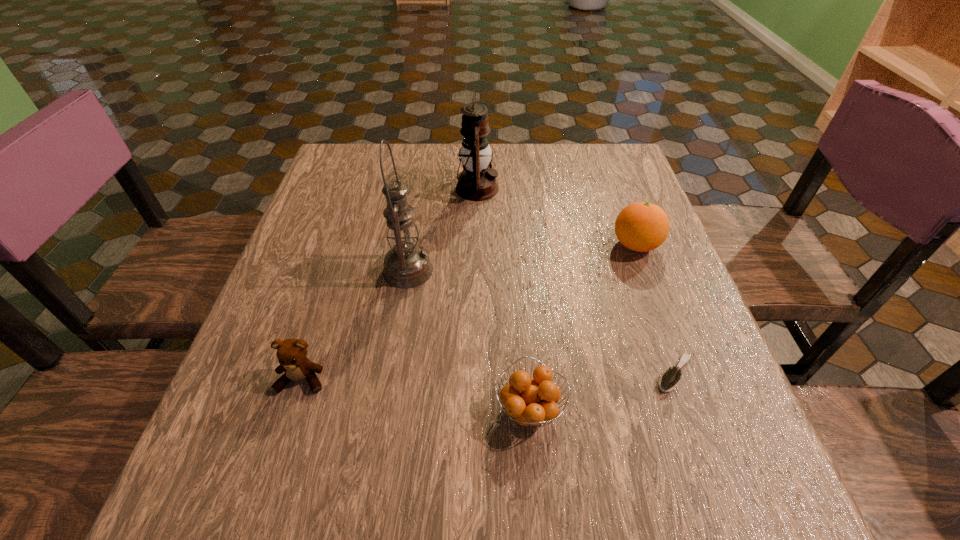
In the image, there is a desktop. At what (x,y) coordinates should I click in order to perform the action: click on vacant space at the left edge. Please return your answer as a coordinate pair (x, y). The width and height of the screenshot is (960, 540). Looking at the image, I should click on (252, 435).

Image resolution: width=960 pixels, height=540 pixels. What are the coordinates of `vacant space at the right edge of the desktop` in the screenshot? It's located at (653, 298).

Where is `free spot at the far left corner of the desktop`? free spot at the far left corner of the desktop is located at coordinates (335, 151).

In the image, there is a desktop. At what (x,y) coordinates should I click in order to perform the action: click on vacant area at the far right corner. Please return your answer as a coordinate pair (x, y). Looking at the image, I should click on (603, 150).

Image resolution: width=960 pixels, height=540 pixels. What are the coordinates of `empty space between the shortest object and the farther orange fruit` in the screenshot? It's located at (655, 309).

Locate an element on the screen. The width and height of the screenshot is (960, 540). free space between the leftmost object and the shorter orange fruit is located at coordinates (416, 394).

Find the location of a particular element. This screenshot has width=960, height=540. empty space between the leftmost object and the fifth tallest object is located at coordinates (416, 394).

Where is `unoccupied position between the shorter orange fruit and the oil lamp`? unoccupied position between the shorter orange fruit and the oil lamp is located at coordinates (468, 340).

In order to click on free spot between the farther orange fruit and the leftmost object in this screenshot , I will do `click(468, 313)`.

At what (x,y) coordinates should I click in order to perform the action: click on empty space that is in between the taller orange fruit and the shorter orange fruit. Please return your answer as a coordinate pair (x, y). This screenshot has width=960, height=540. Looking at the image, I should click on (583, 327).